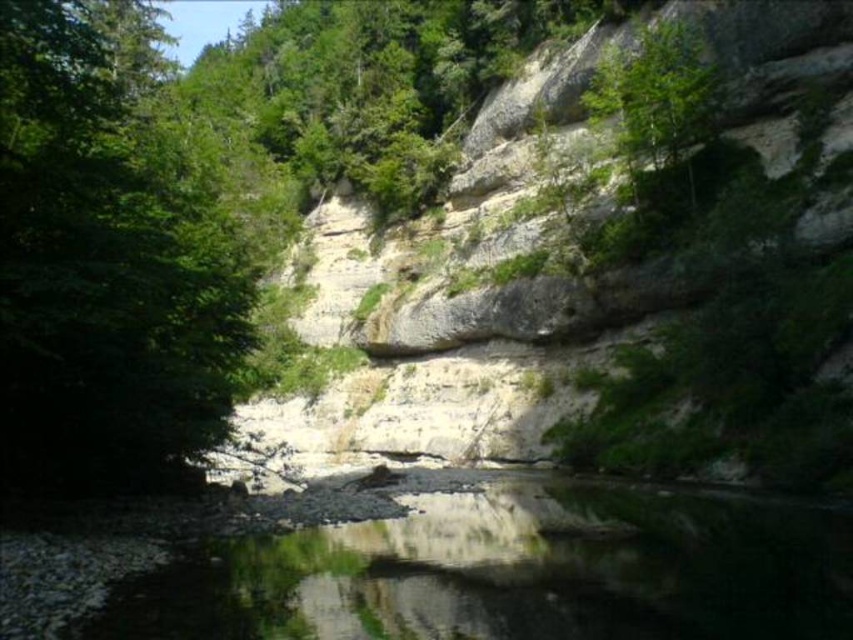
You are standing at the base of the cliff and want to reach the point marked at coordinates point [473,544]. Considering the distance, is this point within a comfortable walking distance for an average person?

The point marked at coordinates point [473,544] is 46.13 meters away from the camera. This distance is within a comfortable walking range for an average person, so yes, it should be reachable without difficulty.

You are standing at the base of the cliff and want to determine the relative heights of the green reflective water at center and the green leafy tree at upper center. Which one is taller?

The green reflective water at center has a lesser height compared to the green leafy tree at upper center, so the green leafy tree at upper center is taller.

You are standing at the edge of the cliff and want to locate the green reflective water at center. According to the coordinates provided, in which direction should you look relative to your position?

The green reflective water at center is located at coordinates point (514, 572), so you should look towards the lower right direction from your position at the cliff edge.